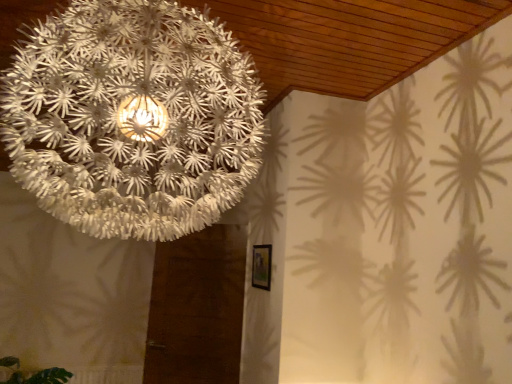
Where is `white paper lampshade at upper center`? white paper lampshade at upper center is located at coordinates (132, 118).

Image resolution: width=512 pixels, height=384 pixels. Describe the element at coordinates (132, 118) in the screenshot. I see `white paper lampshade at upper center` at that location.

In order to face white paper lampshade at upper center, should I rotate leftwards or rightwards?

To align with it, rotate left about 14.829°.

The height and width of the screenshot is (384, 512). What do you see at coordinates (33, 374) in the screenshot?
I see `green leafy plant at lower left` at bounding box center [33, 374].

Measure the distance between point (22, 381) and camera.

They are 12.35 feet apart.

This screenshot has width=512, height=384. Find the location of `green leafy plant at lower left`. green leafy plant at lower left is located at coordinates (33, 374).

Identify the location of white paper lampshade at upper center. The image size is (512, 384). (132, 118).

Considering the relative positions of green leafy plant at lower left and white paper lampshade at upper center in the image provided, is green leafy plant at lower left to the left or to the right of white paper lampshade at upper center?

Clearly, green leafy plant at lower left is on the left of white paper lampshade at upper center in the image.

Which is behind, green leafy plant at lower left or white paper lampshade at upper center?

green leafy plant at lower left.

Between point (57, 373) and point (53, 25), which one is positioned in front?

The point (53, 25) is in front.

From the image's perspective, which one is positioned higher, green leafy plant at lower left or white paper lampshade at upper center?

white paper lampshade at upper center, from the image's perspective.

From a real-world perspective, who is located lower, green leafy plant at lower left or white paper lampshade at upper center?

green leafy plant at lower left is physically lower.

Does green leafy plant at lower left have a greater width compared to white paper lampshade at upper center?

Incorrect, the width of green leafy plant at lower left does not surpass that of white paper lampshade at upper center.

From their relative heights in the image, would you say green leafy plant at lower left is taller or shorter than white paper lampshade at upper center?

Clearly, green leafy plant at lower left is shorter compared to white paper lampshade at upper center.

Does green leafy plant at lower left have a smaller size compared to white paper lampshade at upper center?

Indeed, green leafy plant at lower left has a smaller size compared to white paper lampshade at upper center.

Is white paper lampshade at upper center a part of green leafy plant at lower left?

No, white paper lampshade at upper center is not surrounded by green leafy plant at lower left.

Is green leafy plant at lower left not near white paper lampshade at upper center?

Yes.

Is green leafy plant at lower left looking in the opposite direction of white paper lampshade at upper center?

No.

Where is `lamp above the green leafy plant at lower left (from the image's perspective)`? lamp above the green leafy plant at lower left (from the image's perspective) is located at coordinates (132, 118).

In the image, is white paper lampshade at upper center on the left side or the right side of green leafy plant at lower left?

From the image, it's evident that white paper lampshade at upper center is to the right of green leafy plant at lower left.

Does white paper lampshade at upper center lie in front of green leafy plant at lower left?

Yes, the depth of white paper lampshade at upper center is less than that of green leafy plant at lower left.

Which is closer, (102, 110) or (66, 382)?

Clearly, point (102, 110) is closer to the camera than point (66, 382).

From the image's perspective, is white paper lampshade at upper center below green leafy plant at lower left?

No, from the image's perspective, white paper lampshade at upper center is not below green leafy plant at lower left.

From a real-world perspective, which is physically below, white paper lampshade at upper center or green leafy plant at lower left?

From a 3D spatial view, green leafy plant at lower left is below.

Considering the sizes of objects white paper lampshade at upper center and green leafy plant at lower left in the image provided, who is wider, white paper lampshade at upper center or green leafy plant at lower left?

white paper lampshade at upper center is wider.

Which of these two, white paper lampshade at upper center or green leafy plant at lower left, stands shorter?

Standing shorter between the two is green leafy plant at lower left.

Considering the relative sizes of white paper lampshade at upper center and green leafy plant at lower left in the image provided, is white paper lampshade at upper center bigger than green leafy plant at lower left?

Correct, white paper lampshade at upper center is larger in size than green leafy plant at lower left.

Is white paper lampshade at upper center not inside green leafy plant at lower left?

That's correct, white paper lampshade at upper center is outside of green leafy plant at lower left.

Would you say white paper lampshade at upper center is a long distance from green leafy plant at lower left?

Yes, white paper lampshade at upper center and green leafy plant at lower left are located far from each other.

Is white paper lampshade at upper center facing towards green leafy plant at lower left?

No, white paper lampshade at upper center is not oriented towards green leafy plant at lower left.

At what (x,y) coordinates should I click in order to perform the action: click on lamp above the green leafy plant at lower left (from the image's perspective). Please return your answer as a coordinate pair (x, y). Image resolution: width=512 pixels, height=384 pixels. Looking at the image, I should click on (132, 118).

Locate an element on the screen. The image size is (512, 384). plant below the white paper lampshade at upper center (from the image's perspective) is located at coordinates (33, 374).

This screenshot has width=512, height=384. Identify the location of plant behind the white paper lampshade at upper center. (33, 374).